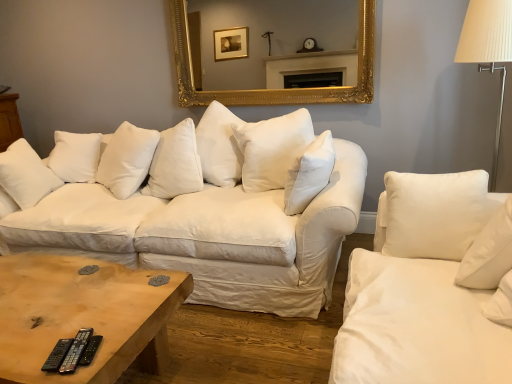
Find the location of `free space in front of black rubber remote at lower left, the second remote in the right-to-left sequence`. free space in front of black rubber remote at lower left, the second remote in the right-to-left sequence is located at coordinates (64, 372).